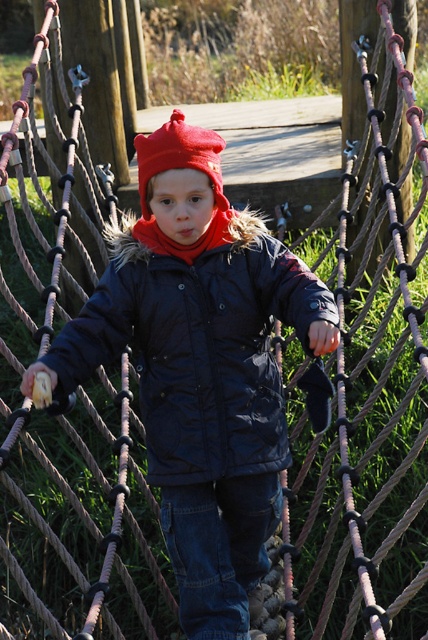
Question: Does dark blue quilted jacket at center have a larger size compared to red knitted hat at center?

Choices:
 (A) yes
 (B) no

Answer: (A)

Question: Observing the image, what is the correct spatial positioning of dark blue quilted jacket at center in reference to red knitted hat at center?

Choices:
 (A) left
 (B) right

Answer: (B)

Question: Which object is closer to the camera taking this photo?

Choices:
 (A) dark blue quilted jacket at center
 (B) red knitted hat at center

Answer: (A)

Question: Which point is farther to the camera?

Choices:
 (A) (195, 426)
 (B) (146, 170)

Answer: (A)

Question: Among these objects, which one is nearest to the camera?

Choices:
 (A) dark blue quilted jacket at center
 (B) red knitted hat at center

Answer: (A)

Question: Does dark blue quilted jacket at center come in front of red knitted hat at center?

Choices:
 (A) yes
 (B) no

Answer: (A)